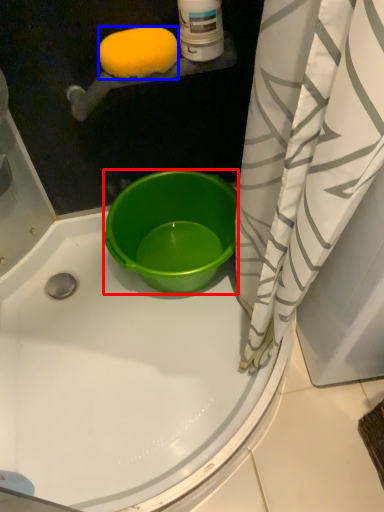
Question: Among these objects, which one is nearest to the camera, bucket (highlighted by a red box) or lemon (highlighted by a blue box)?

Choices:
 (A) bucket
 (B) lemon

Answer: (B)